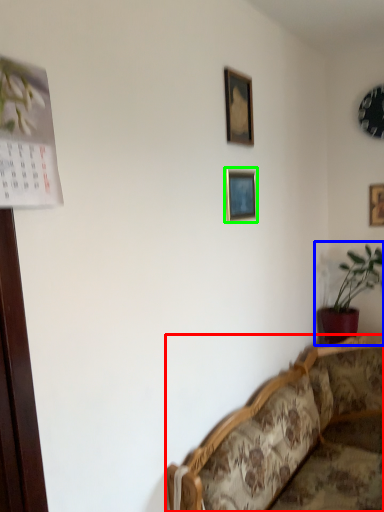
Question: Estimate the real-world distances between objects in this image. Which object is closer to studio couch (highlighted by a red box), houseplant (highlighted by a blue box) or picture frame (highlighted by a green box)?

Choices:
 (A) houseplant
 (B) picture frame

Answer: (A)